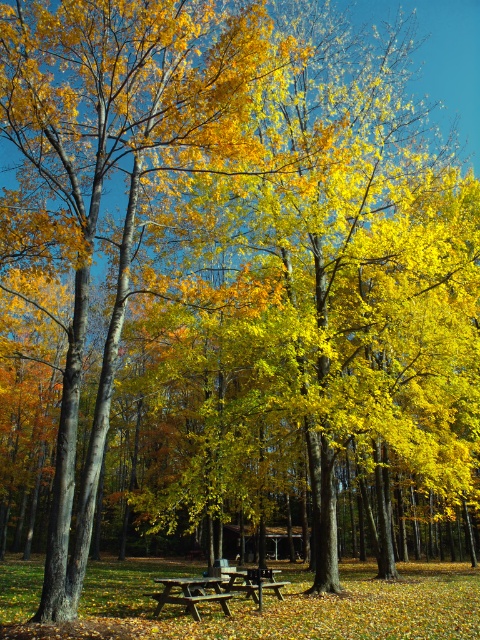
Does wooden picnic table at center appear on the right side of wooden picnic table at lower center?

Incorrect, wooden picnic table at center is not on the right side of wooden picnic table at lower center.

This screenshot has width=480, height=640. Find the location of `wooden picnic table at center`. wooden picnic table at center is located at coordinates click(x=216, y=588).

Locate an element on the screen. wooden picnic table at center is located at coordinates (216, 588).